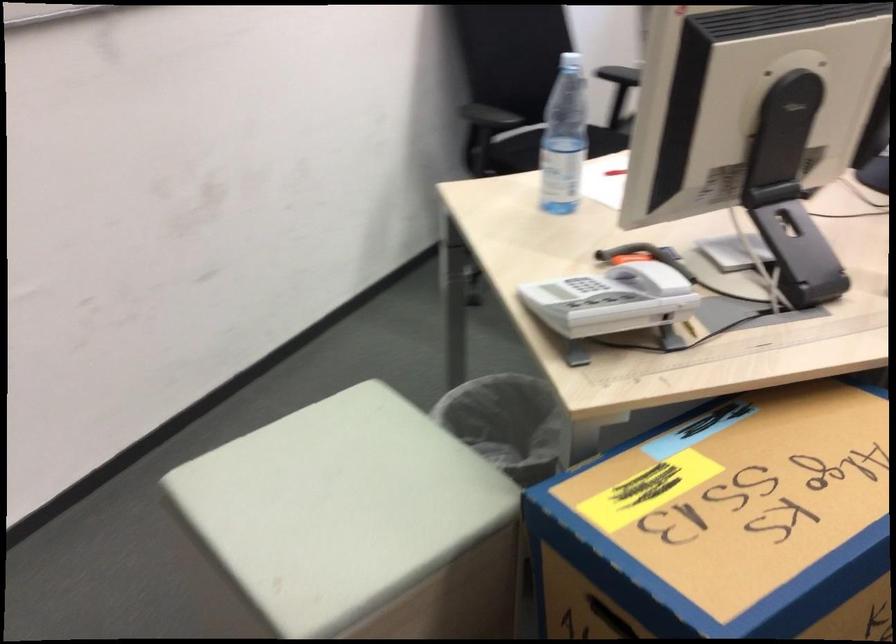
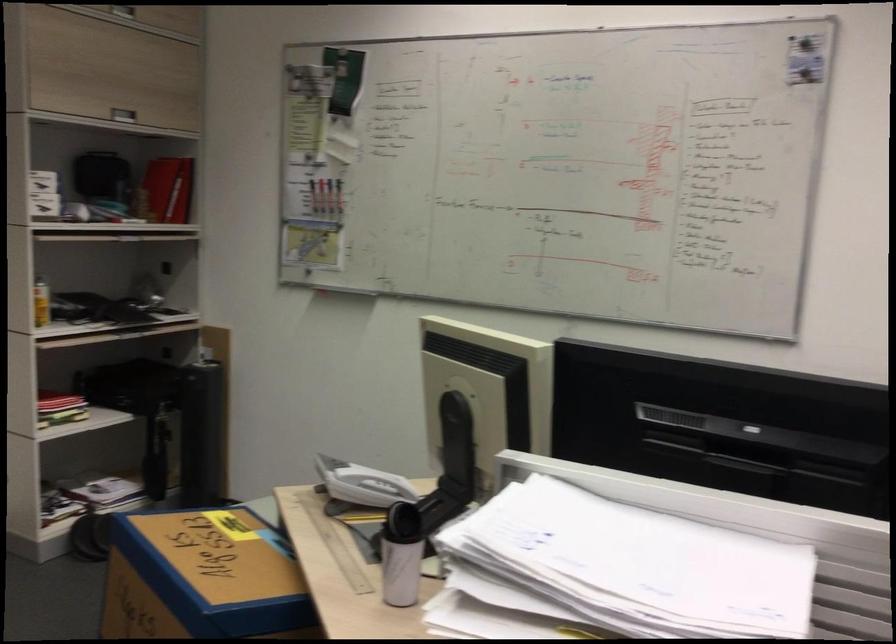
Locate, in the second image, the point that corresponds to point (771, 152) in the first image.

(457, 453)